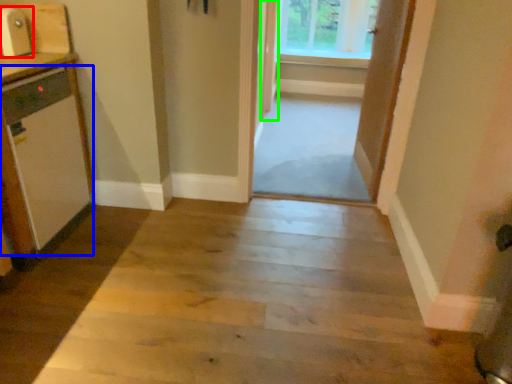
Question: Which object is positioned farthest from appliance (highlighted by a red box)? Select from appliance (highlighted by a blue box) and door (highlighted by a green box).

Choices:
 (A) appliance
 (B) door

Answer: (B)